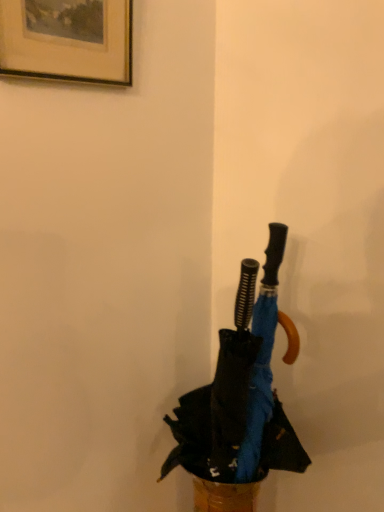
Measure the distance between point (83, 15) and camera.

27.76 inches.

This screenshot has height=512, width=384. Identify the location of brushed metal picture frame at upper left. coord(67,40).

The width and height of the screenshot is (384, 512). Describe the element at coordinates (67, 40) in the screenshot. I see `brushed metal picture frame at upper left` at that location.

The height and width of the screenshot is (512, 384). What do you see at coordinates (241, 392) in the screenshot? I see `blue fabric umbrella at center` at bounding box center [241, 392].

What are the coordinates of `blue fabric umbrella at center` in the screenshot? It's located at (241, 392).

Identify the location of brushed metal picture frame at upper left. The width and height of the screenshot is (384, 512). (67, 40).

Between blue fabric umbrella at center and brushed metal picture frame at upper left, which one appears on the left side from the viewer's perspective?

brushed metal picture frame at upper left.

Is blue fabric umbrella at center closer to the viewer compared to brushed metal picture frame at upper left?

No, blue fabric umbrella at center is further to the viewer.

Considering the points (258, 370) and (124, 50), which point is behind, point (258, 370) or point (124, 50)?

Positioned behind is point (258, 370).

From the image's perspective, is blue fabric umbrella at center located above or below brushed metal picture frame at upper left?

Based on their image positions, blue fabric umbrella at center is located beneath brushed metal picture frame at upper left.

From a real-world perspective, relative to brushed metal picture frame at upper left, is blue fabric umbrella at center vertically above or below?

Clearly, from a real-world perspective, blue fabric umbrella at center is below brushed metal picture frame at upper left.

Can you confirm if blue fabric umbrella at center is wider than brushed metal picture frame at upper left?

Indeed, blue fabric umbrella at center has a greater width compared to brushed metal picture frame at upper left.

Is blue fabric umbrella at center shorter than brushed metal picture frame at upper left?

No, blue fabric umbrella at center is not shorter than brushed metal picture frame at upper left.

Who is bigger, blue fabric umbrella at center or brushed metal picture frame at upper left?

Bigger between the two is blue fabric umbrella at center.

Would you say blue fabric umbrella at center is outside brushed metal picture frame at upper left?

blue fabric umbrella at center is positioned outside brushed metal picture frame at upper left.

Is blue fabric umbrella at center far away from brushed metal picture frame at upper left?

That's not correct — blue fabric umbrella at center is a little close to brushed metal picture frame at upper left.

Could you tell me if blue fabric umbrella at center is turned towards brushed metal picture frame at upper left?

No, blue fabric umbrella at center is not oriented towards brushed metal picture frame at upper left.

Measure the distance between blue fabric umbrella at center and brushed metal picture frame at upper left.

A distance of 60.28 centimeters exists between blue fabric umbrella at center and brushed metal picture frame at upper left.

This screenshot has height=512, width=384. What are the coordinates of `picture frame positioned vertically above the blue fabric umbrella at center (from a real-world perspective)` in the screenshot? It's located at coord(67,40).

Does brushed metal picture frame at upper left appear on the left side of blue fabric umbrella at center?

Indeed, brushed metal picture frame at upper left is positioned on the left side of blue fabric umbrella at center.

Which object is more forward, brushed metal picture frame at upper left or blue fabric umbrella at center?

brushed metal picture frame at upper left is closer to the camera.

Considering the points (60, 52) and (177, 409), which point is in front, point (60, 52) or point (177, 409)?

Positioned in front is point (60, 52).

From the image's perspective, is brushed metal picture frame at upper left below blue fabric umbrella at center?

Actually, brushed metal picture frame at upper left appears above blue fabric umbrella at center in the image.

From a real-world perspective, between brushed metal picture frame at upper left and blue fabric umbrella at center, who is vertically lower?

blue fabric umbrella at center.

Does brushed metal picture frame at upper left have a greater width compared to blue fabric umbrella at center?

No, brushed metal picture frame at upper left is not wider than blue fabric umbrella at center.

Is brushed metal picture frame at upper left taller than blue fabric umbrella at center?

No.

Between brushed metal picture frame at upper left and blue fabric umbrella at center, which one has larger size?

With larger size is blue fabric umbrella at center.

Is blue fabric umbrella at center inside brushed metal picture frame at upper left?

No.

Is brushed metal picture frame at upper left beside blue fabric umbrella at center?

There is a gap between brushed metal picture frame at upper left and blue fabric umbrella at center.

Does brushed metal picture frame at upper left turn towards blue fabric umbrella at center?

No, brushed metal picture frame at upper left is not facing towards blue fabric umbrella at center.

Can you tell me how much brushed metal picture frame at upper left and blue fabric umbrella at center differ in facing direction?

brushed metal picture frame at upper left and blue fabric umbrella at center are facing 92 degrees away from each other.

What are the coordinates of `umbrella below the brushed metal picture frame at upper left (from the image's perspective)` in the screenshot? It's located at (241, 392).

Where is `umbrella on the right side of brushed metal picture frame at upper left`? umbrella on the right side of brushed metal picture frame at upper left is located at coordinates (241, 392).

Identify the location of picture frame lying in front of the blue fabric umbrella at center. (67, 40).